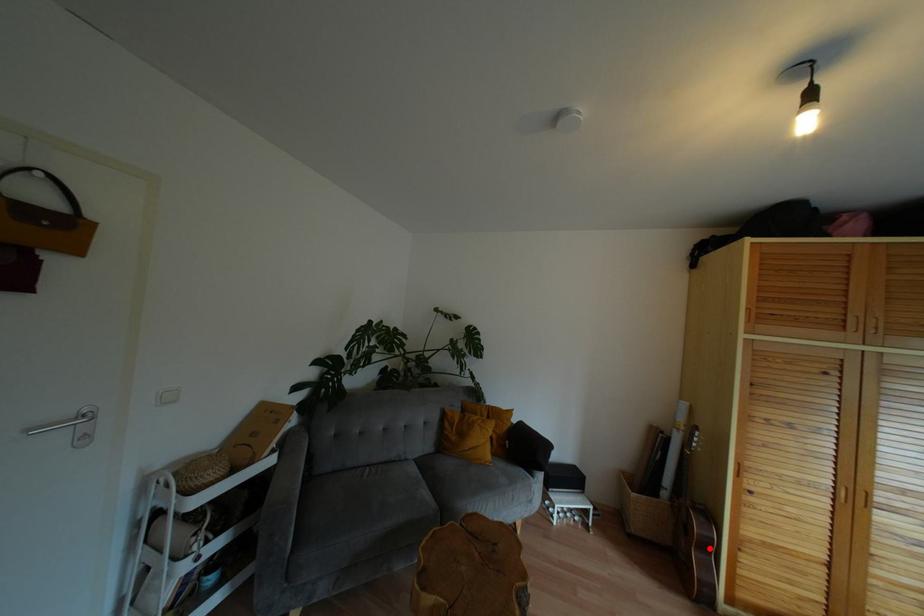
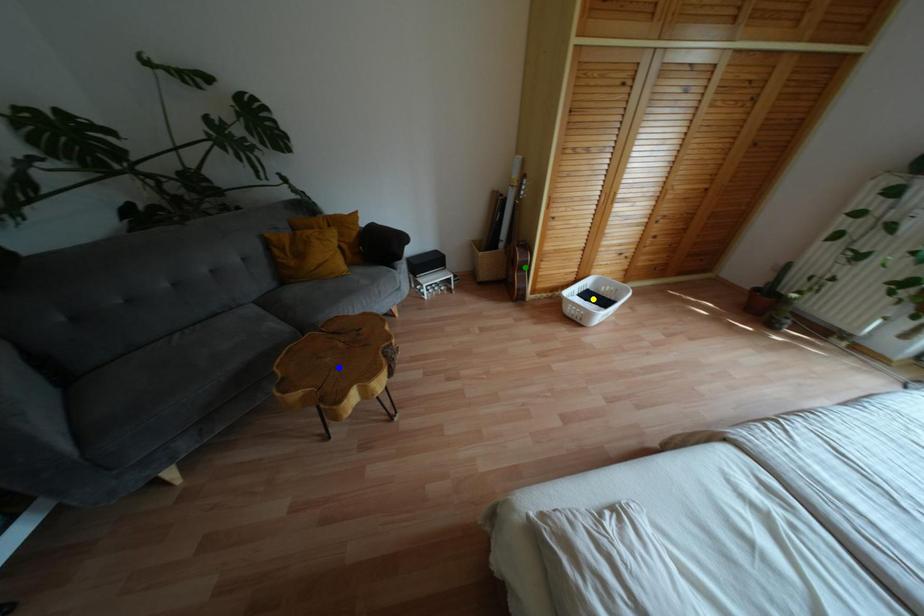
Question: I am providing you with two images of the same scene from different viewpoints. A red point is marked on the first image. You are given multiple points on the second image. Which mark in image 2 goes with the point in image 1?

Choices:
 (A) yellow point
 (B) blue point
 (C) green point

Answer: (C)